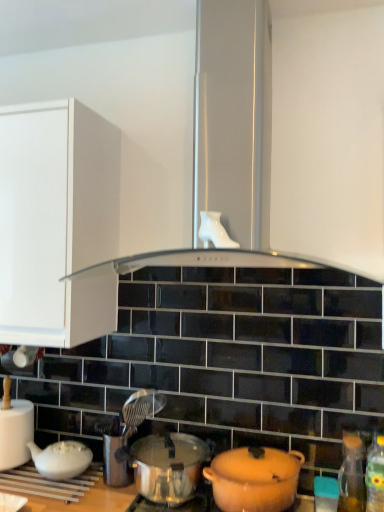
Question: Which direction should I rotate to look at matte orange pot at lower center, positioned as the 2th pot/pan in left-to-right order, — up or down?

Choices:
 (A) up
 (B) down

Answer: (B)

Question: Can you confirm if shiny silver pot at center, arranged as the first pot/pan when viewed from the left, is positioned to the left of white matte teapot at lower left?

Choices:
 (A) yes
 (B) no

Answer: (B)

Question: Is shiny silver pot at center, arranged as the first pot/pan when viewed from the left, positioned with its back to white matte teapot at lower left?

Choices:
 (A) yes
 (B) no

Answer: (B)

Question: Does shiny silver pot at center, arranged as the 2th pot/pan when viewed from the right, come behind white matte teapot at lower left?

Choices:
 (A) no
 (B) yes

Answer: (A)

Question: From the image's perspective, is shiny silver pot at center, arranged as the first pot/pan when viewed from the left, under white matte teapot at lower left?

Choices:
 (A) no
 (B) yes

Answer: (B)

Question: From a real-world perspective, is shiny silver pot at center, arranged as the first pot/pan when viewed from the left, located higher than white matte teapot at lower left?

Choices:
 (A) no
 (B) yes

Answer: (A)

Question: Can you confirm if shiny silver pot at center, arranged as the 2th pot/pan when viewed from the right, is shorter than white matte teapot at lower left?

Choices:
 (A) no
 (B) yes

Answer: (B)

Question: Is transparent glass bottle at lower right, which is counted as the first bottle, starting from the back, not near black glass exhaust hood at center?

Choices:
 (A) no
 (B) yes

Answer: (A)

Question: From a real-world perspective, is transparent glass bottle at lower right, which is counted as the first bottle, starting from the back, located beneath black glass exhaust hood at center?

Choices:
 (A) yes
 (B) no

Answer: (A)

Question: From a real-world perspective, is transparent glass bottle at lower right, which ranks as the 2th bottle in front-to-back order, on black glass exhaust hood at center?

Choices:
 (A) yes
 (B) no

Answer: (B)

Question: Is transparent glass bottle at lower right, which ranks as the 2th bottle in front-to-back order, directly adjacent to black glass exhaust hood at center?

Choices:
 (A) no
 (B) yes

Answer: (A)

Question: Can you confirm if transparent glass bottle at lower right, which ranks as the 2th bottle in front-to-back order, is taller than black glass exhaust hood at center?

Choices:
 (A) no
 (B) yes

Answer: (A)

Question: Does transparent glass bottle at lower right, which is counted as the first bottle, starting from the back, appear on the left side of black glass exhaust hood at center?

Choices:
 (A) yes
 (B) no

Answer: (B)

Question: Can you confirm if black glass exhaust hood at center is shorter than transparent glass bottle at lower right, which ranks as the 2th bottle in front-to-back order?

Choices:
 (A) no
 (B) yes

Answer: (A)